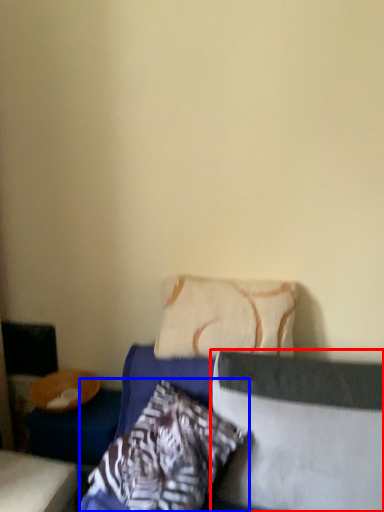
Question: Which object appears closest to the camera in this image, pillow (highlighted by a red box) or pillow (highlighted by a blue box)?

Choices:
 (A) pillow
 (B) pillow

Answer: (B)